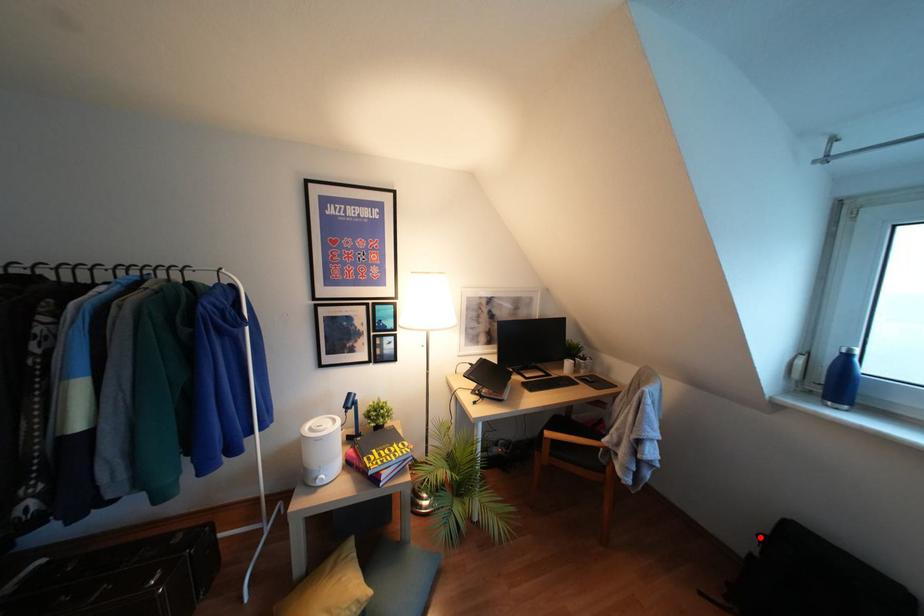
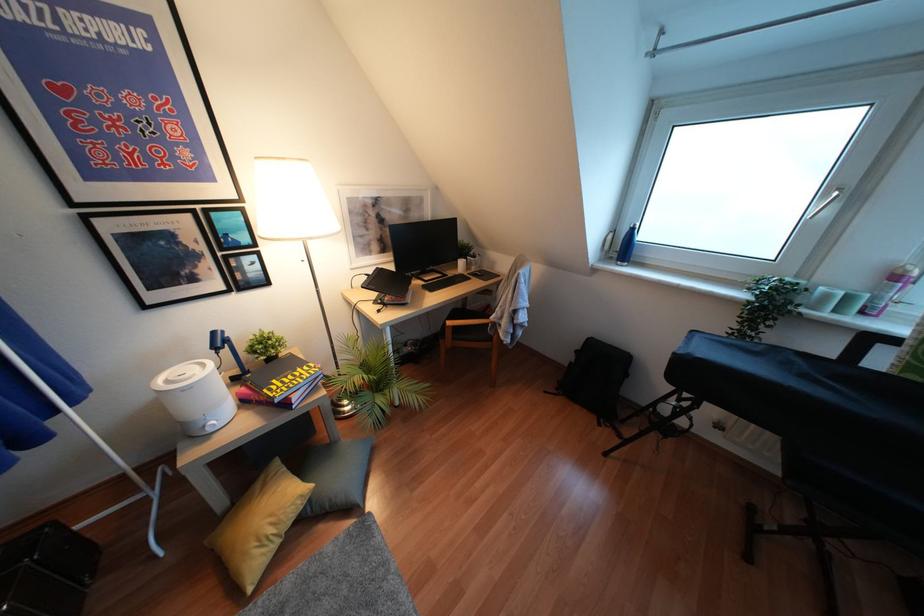
Question: I am providing you with two images of the same scene from different viewpoints. Given a red point in image1, look at the same physical point in image2. Is it:

Choices:
 (A) Closer to the viewpoint
 (B) Farther from the viewpoint

Answer: (A)